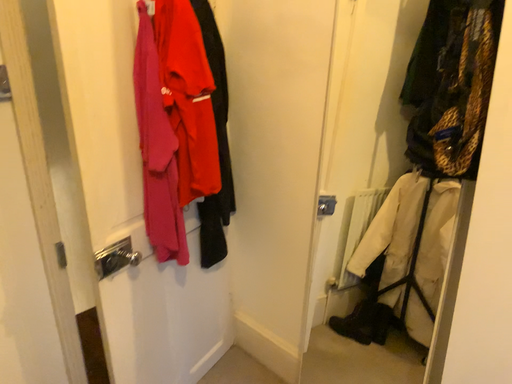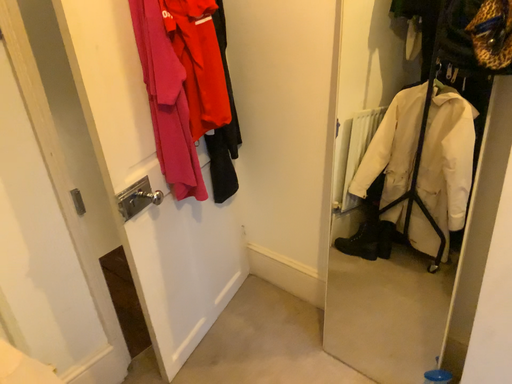
Question: Which way did the camera rotate in the video?

Choices:
 (A) rotated downward
 (B) rotated upward

Answer: (A)